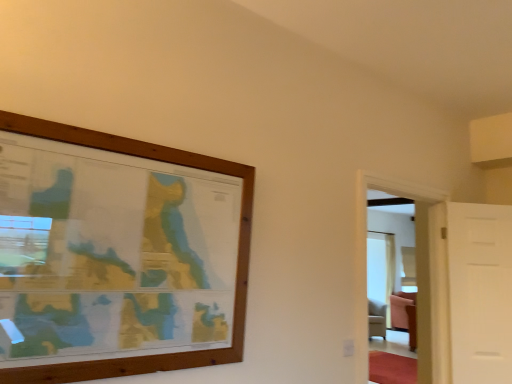
Question: Looking at their shapes, would you say transparent glass door at right is wider or thinner than white matte door at right?

Choices:
 (A) thin
 (B) wide

Answer: (B)

Question: Which is correct: transparent glass door at right is inside white matte door at right, or outside of it?

Choices:
 (A) inside
 (B) outside

Answer: (B)

Question: From the image's perspective, relative to white matte door at right, is transparent glass door at right above or below?

Choices:
 (A) above
 (B) below

Answer: (A)

Question: In terms of size, does white matte door at right appear bigger or smaller than transparent glass door at right?

Choices:
 (A) big
 (B) small

Answer: (B)

Question: Is white matte door at right wider or thinner than transparent glass door at right?

Choices:
 (A) wide
 (B) thin

Answer: (B)

Question: From the image's perspective, is white matte door at right positioned above or below transparent glass door at right?

Choices:
 (A) below
 (B) above

Answer: (A)

Question: Is white matte door at right inside the boundaries of transparent glass door at right, or outside?

Choices:
 (A) outside
 (B) inside

Answer: (A)